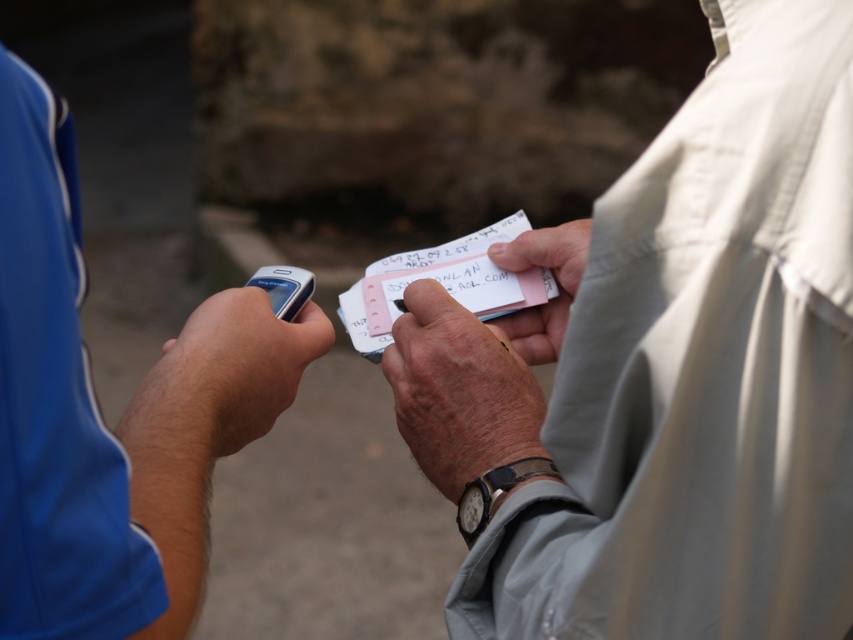
Describe the element at coordinates (669, 371) in the screenshot. Image resolution: width=853 pixels, height=640 pixels. I see `light beige fabric shirt at right` at that location.

Does light beige fabric shirt at right appear over pink paper card at center?

No, light beige fabric shirt at right is not above pink paper card at center.

Is point (488, 372) positioned behind point (428, 253)?

No, (488, 372) is closer to viewer.

At what (x,y) coordinates should I click in order to perform the action: click on light beige fabric shirt at right. Please return your answer as a coordinate pair (x, y). Looking at the image, I should click on (669, 371).

Does point (434, 349) come in front of point (502, 497)?

No, it is behind (502, 497).

Which is more to the left, leather wristwatch at center or black leather watch at center?

Positioned to the left is leather wristwatch at center.

Which is in front, point (407, 426) or point (502, 484)?

Point (502, 484) is in front.

Where is `leather wristwatch at center`? The image size is (853, 640). leather wristwatch at center is located at coordinates (457, 390).

Can you confirm if matte plastic phone at left is taller than pink paper card at center?

No, matte plastic phone at left is not taller than pink paper card at center.

Describe the element at coordinates (223, 378) in the screenshot. The height and width of the screenshot is (640, 853). I see `matte plastic phone at left` at that location.

Between point (267, 388) and point (469, 305), which one is positioned in front?

Point (267, 388) is in front.

Where is `matte plastic phone at left`? matte plastic phone at left is located at coordinates (223, 378).